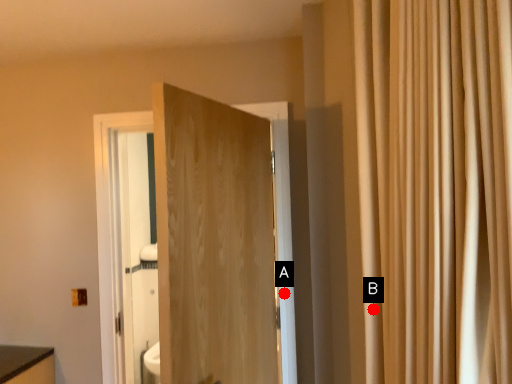
Question: Two points are circled on the image, labeled by A and B beside each circle. Which point is closer to the camera?

Choices:
 (A) A is closer
 (B) B is closer

Answer: (B)